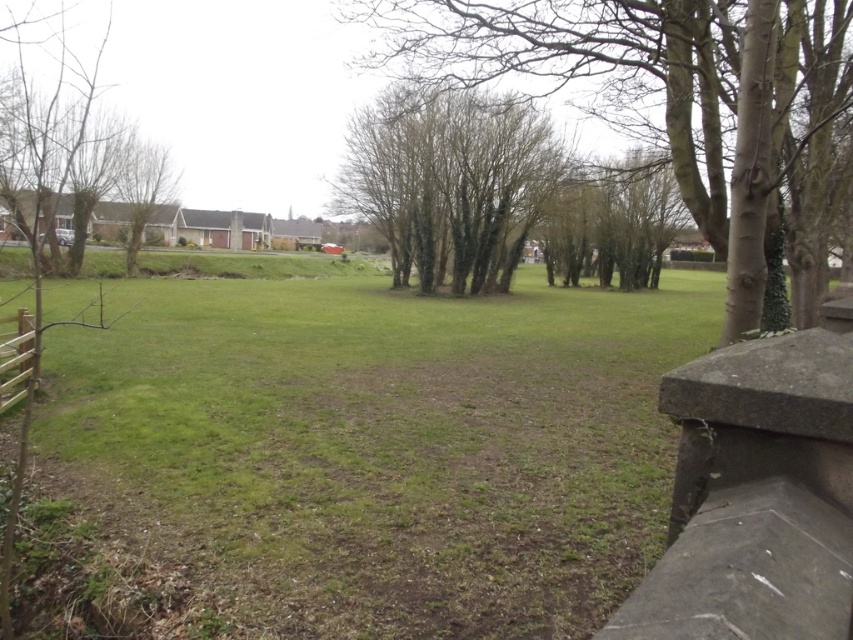
Question: Estimate the real-world distances between objects in this image. Which object is closer to the brown wooden fence at lower left?

Choices:
 (A) brown leafless tree at left
 (B) bare branches at center

Answer: (B)

Question: From the image, what is the correct spatial relationship of bare branches at center in relation to brown leafless tree at left?

Choices:
 (A) below
 (B) above

Answer: (A)

Question: Is the position of bare branches at center less distant than that of brown wooden fence at lower left?

Choices:
 (A) yes
 (B) no

Answer: (A)

Question: Which point is closer to the camera?

Choices:
 (A) (751, 76)
 (B) (64, 138)
 (C) (9, 358)

Answer: (A)

Question: Based on their relative distances, which object is farther from the brown leafless tree at left?

Choices:
 (A) brown wooden fence at lower left
 (B) bare branches at center

Answer: (A)

Question: Does bare branches at center appear over brown leafless tree at left?

Choices:
 (A) yes
 (B) no

Answer: (B)